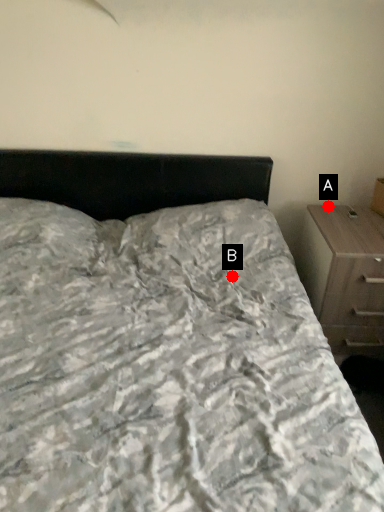
Question: Two points are circled on the image, labeled by A and B beside each circle. Which point is closer to the camera?

Choices:
 (A) A is closer
 (B) B is closer

Answer: (B)